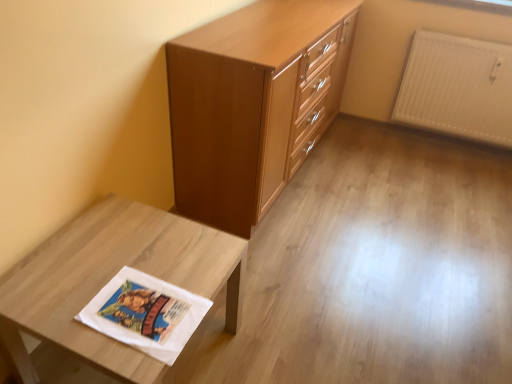
Question: From the image's perspective, is matte wood chest of drawers at center located above or below white matte fabric at lower left?

Choices:
 (A) below
 (B) above

Answer: (B)

Question: From a real-world perspective, is matte wood chest of drawers at center positioned above or below white matte fabric at lower left?

Choices:
 (A) above
 (B) below

Answer: (A)

Question: Which of these objects is positioned closest to the white matte fabric at lower left?

Choices:
 (A) white textured radiator at upper right
 (B) matte wood chest of drawers at center

Answer: (B)

Question: Which object is positioned closest to the white textured radiator at upper right?

Choices:
 (A) white matte fabric at lower left
 (B) matte wood chest of drawers at center

Answer: (B)